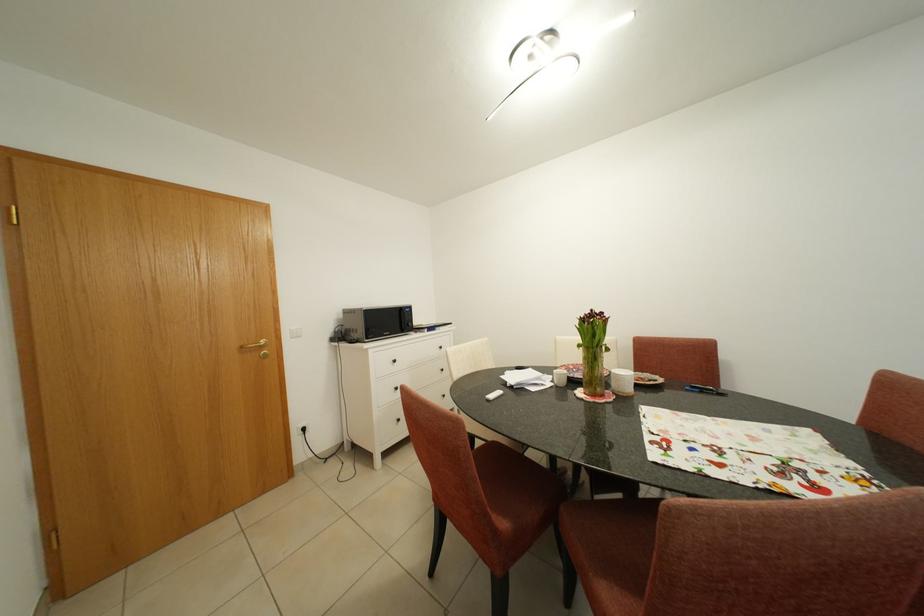
This screenshot has width=924, height=616. Describe the element at coordinates (257, 347) in the screenshot. I see `a gold door handle` at that location.